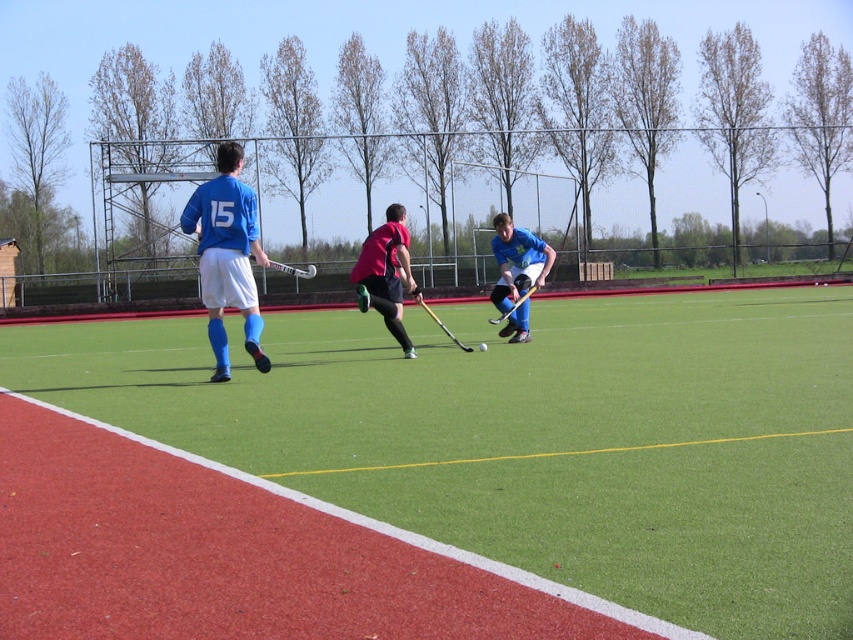
Where is `shiny red shorts at center`? shiny red shorts at center is located at coordinates (386, 273).

Measure the distance from shiny red shorts at center to wooden hockey stick at center.

shiny red shorts at center and wooden hockey stick at center are 2.13 meters apart.

Who is more distant from viewer, (387, 230) or (489, 320)?

Positioned behind is point (489, 320).

You are a GUI agent. You are given a task and a screenshot of the screen. Output one action in this format:
    pyautogui.click(x=<x>, y=<y>)
    Task: Click on the shiny red shorts at center
    The width and height of the screenshot is (853, 640).
    Given the screenshot: What is the action you would take?
    pyautogui.click(x=386, y=273)

Who is positioned more to the right, green artificial turf at center or matte blue jersey at left?

Positioned to the right is green artificial turf at center.

Does point (350, 348) come farther from viewer compared to point (231, 264)?

Yes, point (350, 348) is farther from viewer.

Which is behind, point (146, 420) or point (199, 220)?

Point (199, 220)

Identify the location of green artificial turf at center. (558, 433).

Who is taller, matte blue jersey at left or shiny red shorts at center?

matte blue jersey at left is taller.

In order to click on matte blue jersey at left in this screenshot , I will do `click(227, 256)`.

Find the location of a particular element. This screenshot has width=853, height=640. matte blue jersey at left is located at coordinates (227, 256).